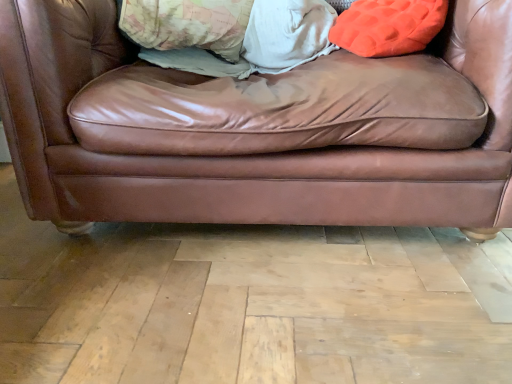
Question: Can you confirm if orange fuzzy pillow at upper right is wider than patterned fabric pillow at upper center?

Choices:
 (A) no
 (B) yes

Answer: (A)

Question: Could you tell me if orange fuzzy pillow at upper right is facing patterned fabric pillow at upper center?

Choices:
 (A) no
 (B) yes

Answer: (A)

Question: Is orange fuzzy pillow at upper right outside of patterned fabric pillow at upper center?

Choices:
 (A) yes
 (B) no

Answer: (A)

Question: Does orange fuzzy pillow at upper right lie behind patterned fabric pillow at upper center?

Choices:
 (A) no
 (B) yes

Answer: (A)

Question: Is orange fuzzy pillow at upper right to the right of patterned fabric pillow at upper center from the viewer's perspective?

Choices:
 (A) yes
 (B) no

Answer: (A)

Question: Considering the positions of point (163, 26) and point (505, 46), is point (163, 26) closer or farther from the camera than point (505, 46)?

Choices:
 (A) farther
 (B) closer

Answer: (A)

Question: Do you think patterned fabric pillow at upper center is within brown leather couch at center, or outside of it?

Choices:
 (A) inside
 (B) outside

Answer: (A)

Question: Considering the positions of patterned fabric pillow at upper center and brown leather couch at center in the image, is patterned fabric pillow at upper center bigger or smaller than brown leather couch at center?

Choices:
 (A) small
 (B) big

Answer: (A)

Question: From their relative heights in the image, would you say patterned fabric pillow at upper center is taller or shorter than brown leather couch at center?

Choices:
 (A) tall
 (B) short

Answer: (B)

Question: From a real-world perspective, is orange fuzzy pillow at upper right positioned above or below brown leather couch at center?

Choices:
 (A) below
 (B) above

Answer: (B)

Question: Considering the positions of orange fuzzy pillow at upper right and brown leather couch at center in the image, is orange fuzzy pillow at upper right wider or thinner than brown leather couch at center?

Choices:
 (A) wide
 (B) thin

Answer: (B)

Question: From the image's perspective, relative to brown leather couch at center, is orange fuzzy pillow at upper right above or below?

Choices:
 (A) above
 (B) below

Answer: (A)

Question: Visually, is orange fuzzy pillow at upper right positioned to the left or to the right of brown leather couch at center?

Choices:
 (A) left
 (B) right

Answer: (B)

Question: Considering the positions of orange fuzzy pillow at upper right and patterned fabric pillow at upper center in the image, is orange fuzzy pillow at upper right bigger or smaller than patterned fabric pillow at upper center?

Choices:
 (A) big
 (B) small

Answer: (B)

Question: Is orange fuzzy pillow at upper right in front of or behind patterned fabric pillow at upper center in the image?

Choices:
 (A) behind
 (B) front

Answer: (B)